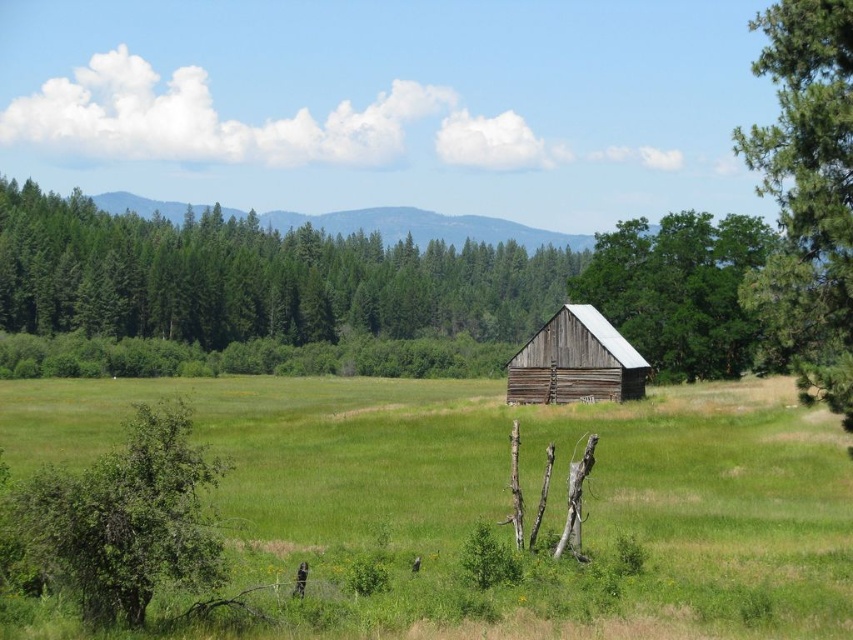
Is point (171, 307) in front of point (772, 259)?

No, (171, 307) is further to viewer.

Is green textured trees at upper left further to camera compared to green textured pine tree at right?

Yes, green textured trees at upper left is behind green textured pine tree at right.

Where is `green textured trees at upper left`? This screenshot has width=853, height=640. green textured trees at upper left is located at coordinates coord(256,276).

At what (x,y) coordinates should I click in order to perform the action: click on green textured trees at upper left. Please return your answer as a coordinate pair (x, y). The height and width of the screenshot is (640, 853). Looking at the image, I should click on (256, 276).

How distant is green grassy pasture at center from green leafy tree at lower left?

The distance of green grassy pasture at center from green leafy tree at lower left is 170.97 feet.

Between point (683, 474) and point (183, 538), which one is positioned in front?

Point (183, 538) is in front.

Is point (129, 394) farther from viewer compared to point (78, 474)?

Yes, point (129, 394) is farther from viewer.

At what (x,y) coordinates should I click in order to perform the action: click on green grassy pasture at center. Please return your answer as a coordinate pair (x, y). The width and height of the screenshot is (853, 640). Looking at the image, I should click on (502, 499).

Is green grassy pasture at center smaller than green textured trees at upper left?

Yes.

Is point (595, 634) less distant than point (12, 237)?

Yes, it is.

At what (x,y) coordinates should I click in order to perform the action: click on green grassy pasture at center. Please return your answer as a coordinate pair (x, y). This screenshot has height=640, width=853. Looking at the image, I should click on (502, 499).